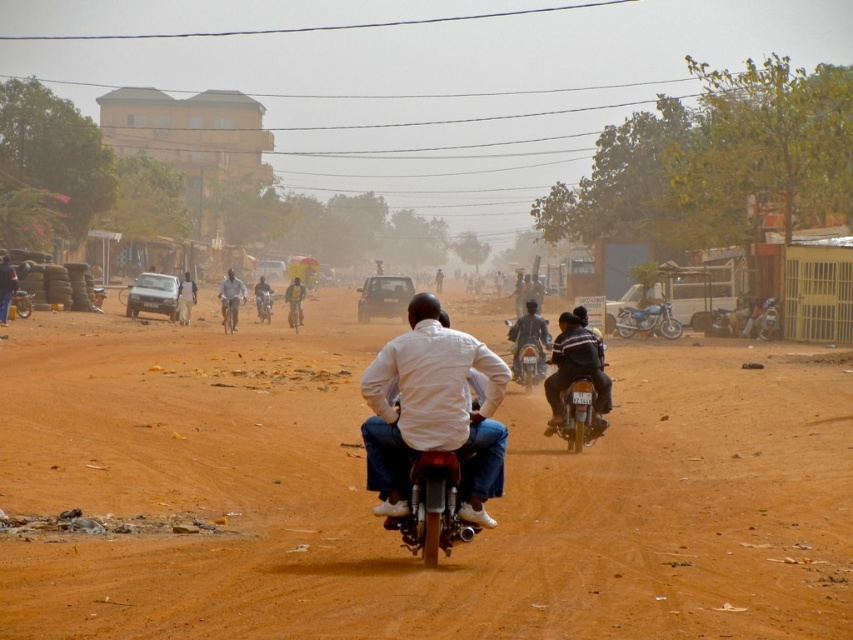
You are a pedestrian standing on the side of the road in this scene. You see a shiny chrome motorcycle at center and dark blue jeans at center. Which object is nearer to you?

The shiny chrome motorcycle at center is closer to the viewer than dark blue jeans at center.

You are a pedestrian standing on the side of the road in the scene. You see two motorcycles at center, a shiny chrome motorcycle at center and a light gray metallic motorcycle at center. Which motorcycle is closer to you?

The shiny chrome motorcycle at center is closer to you because it is located below the light gray metallic motorcycle at center, indicating it is positioned lower and thus nearer in the scene.

You are standing at the side of the road in the scene and see the light gray metallic motorcycle at center and the dark blue jeans at center. Which object is positioned to the right side?

The light gray metallic motorcycle at center is to the right of the dark blue jeans at center.